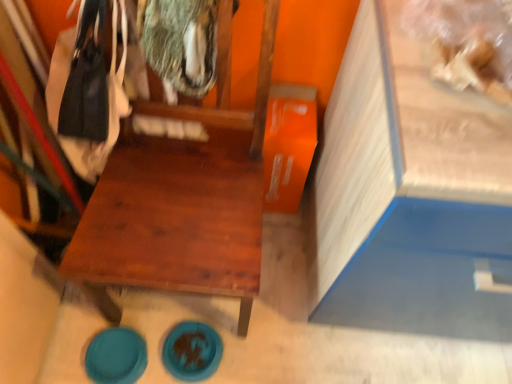
This screenshot has height=384, width=512. What are the coordinates of `vacant space in teal glossy plate at lower left, which ranks as the 1th plate in left-to-right order (from a real-world perspective)` in the screenshot? It's located at (116, 361).